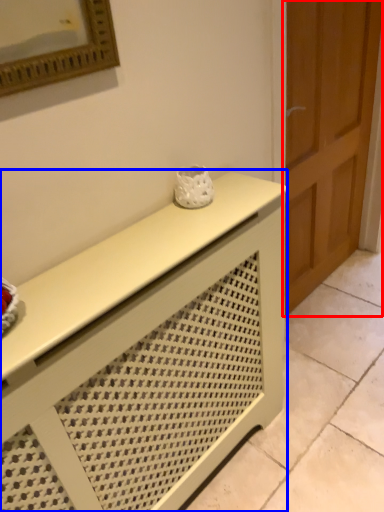
Question: Among these objects, which one is nearest to the camera, door (highlighted by a red box) or furniture (highlighted by a blue box)?

Choices:
 (A) door
 (B) furniture

Answer: (B)